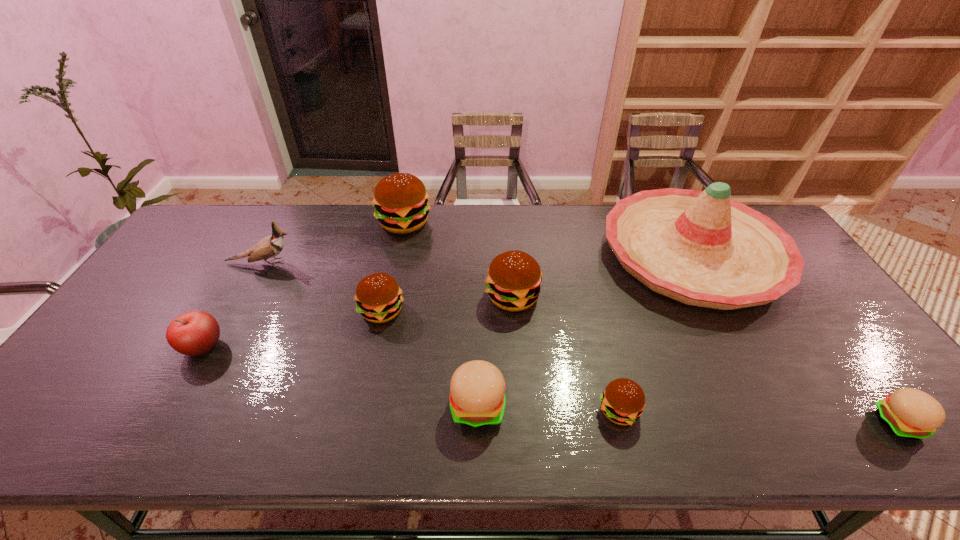
This screenshot has height=540, width=960. Find the location of `vacant area that satisfies the following two spatial constraints: 1. at the face of the bird; 2. on the back side of the smaller beige hamburger`. vacant area that satisfies the following two spatial constraints: 1. at the face of the bird; 2. on the back side of the smaller beige hamburger is located at coordinates (176, 423).

I want to click on vacant space that satisfies the following two spatial constraints: 1. on the back side of the second brown hamburger from right to left; 2. on the right side of the red sombrero, so click(510, 255).

At what (x,y) coordinates should I click in order to perform the action: click on free space that satisfies the following two spatial constraints: 1. on the back side of the second brown hamburger from right to left; 2. at the face of the bird. Please return your answer as a coordinate pair (x, y). The width and height of the screenshot is (960, 540). Looking at the image, I should click on (511, 263).

The height and width of the screenshot is (540, 960). Find the location of `free location that satisfies the following two spatial constraints: 1. on the back side of the seventh object from left to right; 2. at the face of the bird`. free location that satisfies the following two spatial constraints: 1. on the back side of the seventh object from left to right; 2. at the face of the bird is located at coordinates point(582,263).